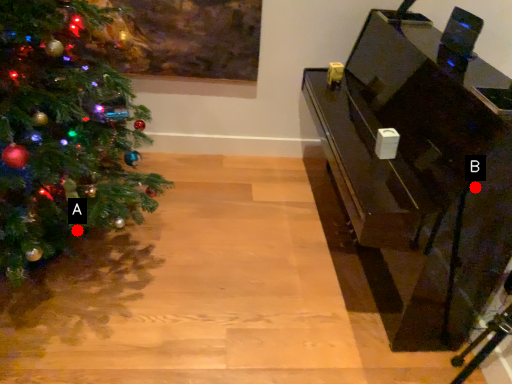
Question: Two points are circled on the image, labeled by A and B beside each circle. Among these points, which one is farthest from the camera?

Choices:
 (A) A is further
 (B) B is further

Answer: (A)